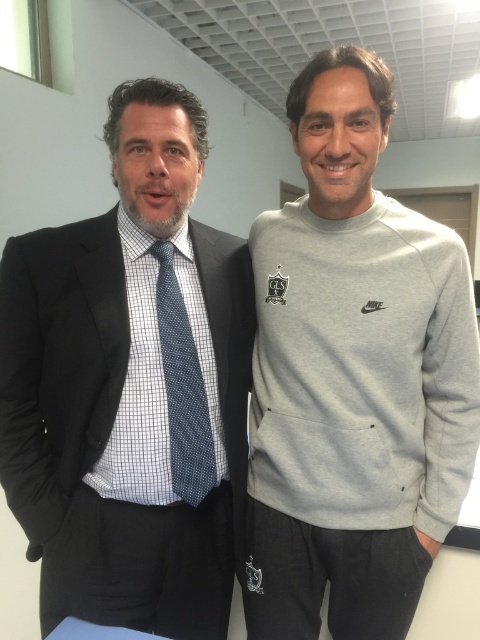
Is point (448, 493) positioned after point (200, 444)?

Yes.

Where is `gray fleece sweatshirt at right`? The height and width of the screenshot is (640, 480). gray fleece sweatshirt at right is located at coordinates (354, 376).

Where is `matte black suit at left`? This screenshot has height=640, width=480. matte black suit at left is located at coordinates (130, 385).

Is point (203, 324) farther from viewer compared to point (374, 288)?

Yes, it is.

You are a GUI agent. You are given a task and a screenshot of the screen. Output one action in this format:
    pyautogui.click(x=<x>, y=<y>)
    Task: Click on the matte black suit at left
    
    Given the screenshot: What is the action you would take?
    pyautogui.click(x=130, y=385)

Is matte black suit at left smaller than blue dotted tie at center?

No.

Does matte black suit at left come in front of blue dotted tie at center?

That is True.

This screenshot has height=640, width=480. Identify the location of matte black suit at left. (130, 385).